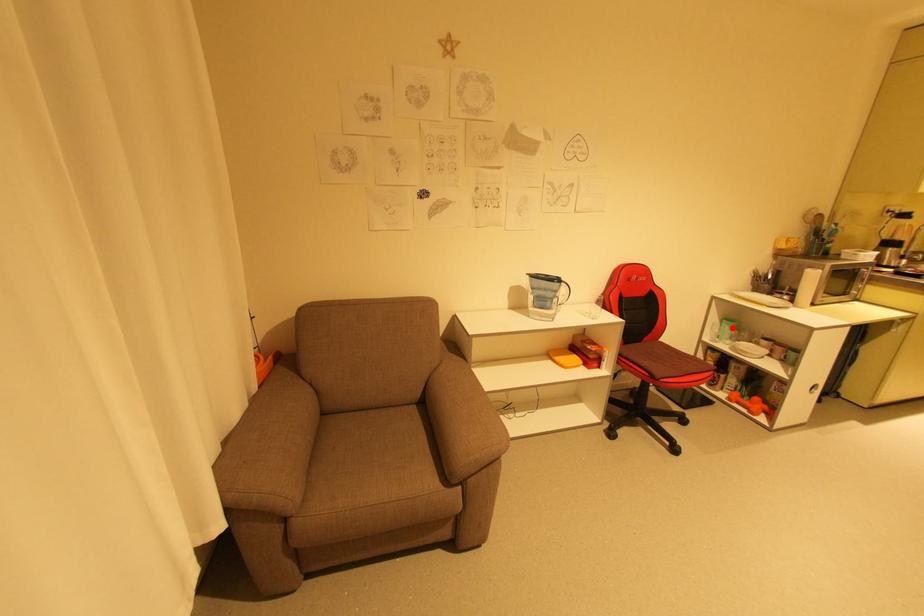
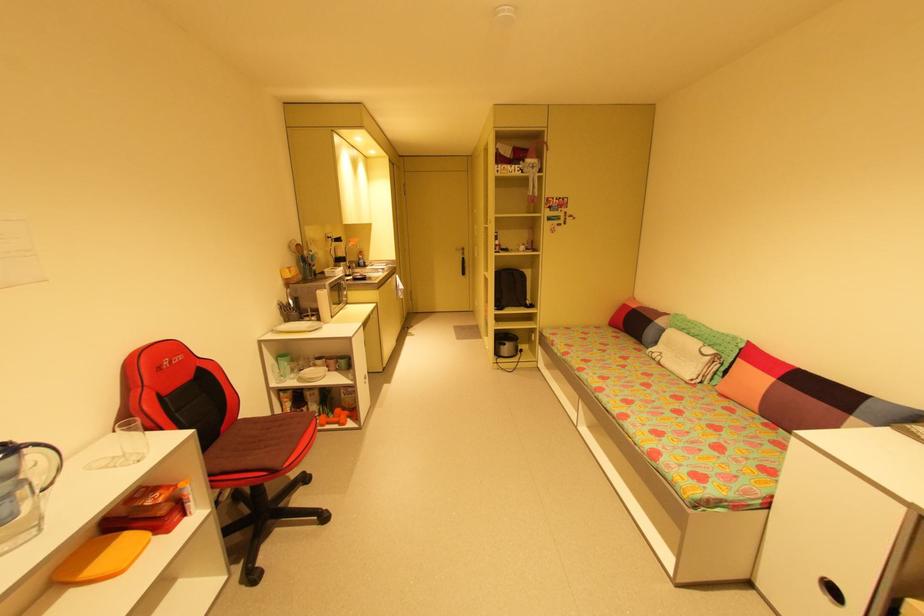
Where in the second image is the point corresponding to the highlighted location from the first image?

(290, 363)